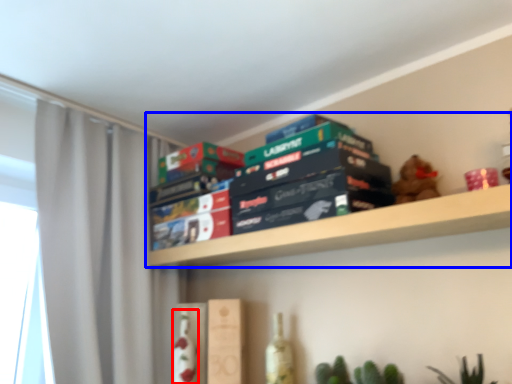
Question: Among these objects, which one is nearest to the camera, bottle (highlighted by a red box) or shelf (highlighted by a blue box)?

Choices:
 (A) bottle
 (B) shelf

Answer: (B)